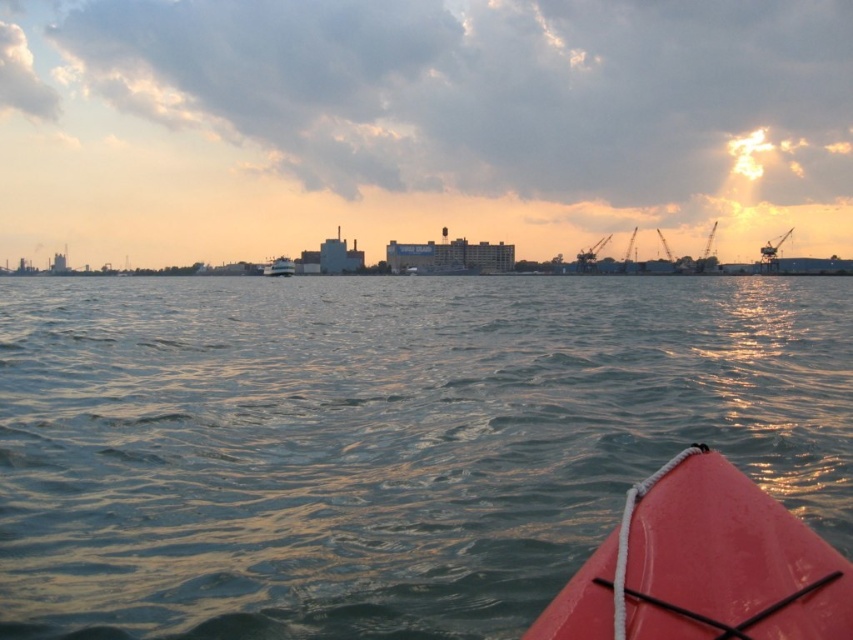
This screenshot has height=640, width=853. What do you see at coordinates (381, 442) in the screenshot?
I see `greenish water at center` at bounding box center [381, 442].

Who is more forward, (218, 305) or (564, 602)?

Point (564, 602) is more forward.

Is point (408, 614) more distant than point (786, 634)?

Yes, point (408, 614) is farther from viewer.

Find the location of a particular element. This screenshot has height=640, width=853. greenish water at center is located at coordinates (381, 442).

Between point (784, 532) and point (267, 269), which one is positioned in front?

Positioned in front is point (784, 532).

Describe the element at coordinates (703, 566) in the screenshot. The image size is (853, 640). I see `rubberized pink kayak at lower right` at that location.

You are a GUI agent. You are given a task and a screenshot of the screen. Output one action in this format:
    pyautogui.click(x=<x>, y=<y>)
    Task: Click on the rubberized pink kayak at lower right
    
    Given the screenshot: What is the action you would take?
    pyautogui.click(x=703, y=566)

Between point (293, 440) and point (276, 260), which one is positioned in front?

Positioned in front is point (293, 440).

Consider the image. Between greenish water at center and white glossy boat at center, which one is positioned lower?

greenish water at center

Who is more distant from viewer, (791, 294) or (283, 257)?

Point (283, 257)

Find the location of a particular element. This screenshot has height=640, width=853. greenish water at center is located at coordinates (381, 442).